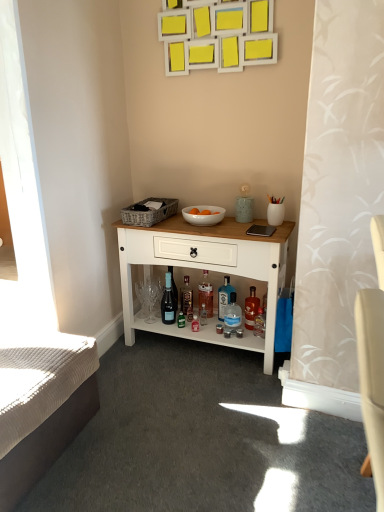
What do you see at coordinates (224, 296) in the screenshot? This screenshot has height=512, width=384. I see `blue glass bottle at lower center, which ranks as the 3th bottle in right-to-left order` at bounding box center [224, 296].

Describe the element at coordinates (205, 268) in the screenshot. I see `white wood cabinet at center` at that location.

Locate an element on the screen. This screenshot has width=384, height=512. white wood cabinet at center is located at coordinates (205, 268).

In the scene shown: In order to face translucent glass bottle at center, the fourth bottle viewed from the right, should I rotate leftwards or rightwards?

You should look right and rotate roughly 1.854 degrees.

The image size is (384, 512). Describe the element at coordinates (251, 308) in the screenshot. I see `translucent glass bottle at lower center, which appears as the first bottle when viewed from the right` at that location.

You are a GUI agent. You are given a task and a screenshot of the screen. Output one action in this format:
    pyautogui.click(x=<x>, y=<y>)
    Task: Click on the white textured mattress at lower left
    This screenshot has height=512, width=384.
    Given the screenshot: What is the action you would take?
    pyautogui.click(x=42, y=406)

Find the location of a particular element. This screenshot has width=384, height=512. white glossy bowl at center is located at coordinates (204, 215).

Is white glossy bowl at center surrounded by translucent glass bottle at lower center, placed as the fifth bottle when sorted from left to right?

No, translucent glass bottle at lower center, placed as the fifth bottle when sorted from left to right, does not contain white glossy bowl at center.

Which point is more forward, [251,320] or [194,207]?

The point [251,320] is closer.

Is translucent glass bottle at lower center, placed as the fifth bottle when sorted from left to right, oriented towards white glossy bowl at center?

No, translucent glass bottle at lower center, placed as the fifth bottle when sorted from left to right, is not turned towards white glossy bowl at center.

Starting from the white wood cabinet at center, which bottle is the 4th one behind? Please provide its 2D coordinates.

[(206, 294)]

Is the surface of white wood cabinet at center in direct contact with translucent glass bottle at center, which ranks as the second bottle in left-to-right order?

No, white wood cabinet at center is not with translucent glass bottle at center, which ranks as the second bottle in left-to-right order.

Is white wood cabinet at center oriented away from translucent glass bottle at center, which ranks as the second bottle in left-to-right order?

Yes, translucent glass bottle at center, which ranks as the second bottle in left-to-right order, is at the back of white wood cabinet at center.

Considering the relative sizes of white wood cabinet at center and translucent glass bottle at center, the fourth bottle viewed from the right, in the image provided, is white wood cabinet at center shorter than translucent glass bottle at center, the fourth bottle viewed from the right,?

No.

Does translucent glass bottle at lower center, placed as the fifth bottle when sorted from left to right, have a larger size compared to white wood cabinet at center?

No.

Considering the positions of objects translucent glass bottle at lower center, which appears as the first bottle when viewed from the right, and white wood cabinet at center in the image provided, who is behind, translucent glass bottle at lower center, which appears as the first bottle when viewed from the right, or white wood cabinet at center?

translucent glass bottle at lower center, which appears as the first bottle when viewed from the right, is more distant.

Is translucent glass bottle at lower center, placed as the fifth bottle when sorted from left to right, at the left side of white wood cabinet at center?

No.

From a real-world perspective, which is physically above, translucent glass bottle at center, the fourth bottle viewed from the right, or transparent glass bottle at center, the 4th bottle when ordered from left to right?

translucent glass bottle at center, the fourth bottle viewed from the right, from a real-world perspective.

Is point (211, 296) more distant than point (230, 304)?

Yes, point (211, 296) is farther from viewer.

Based on their positions, is translucent glass bottle at center, the fourth bottle viewed from the right, located to the left or right of transparent glass bottle at center, the 4th bottle when ordered from left to right?

Based on their positions, translucent glass bottle at center, the fourth bottle viewed from the right, is located to the left of transparent glass bottle at center, the 4th bottle when ordered from left to right.

From their relative heights in the image, would you say translucent glass bottle at center, which ranks as the second bottle in left-to-right order, is taller or shorter than transparent glass bottle at center, which is counted as the second bottle, starting from the right?

Considering their sizes, translucent glass bottle at center, which ranks as the second bottle in left-to-right order, has more height than transparent glass bottle at center, which is counted as the second bottle, starting from the right.

Between point (173, 334) and point (221, 288), which one is positioned behind?

The point (221, 288) is more distant.

Does white wood cabinet at center appear on the right side of blue glass bottle at lower center, which ranks as the 3th bottle in right-to-left order?

No, white wood cabinet at center is not to the right of blue glass bottle at lower center, which ranks as the 3th bottle in right-to-left order.

Find the location of a particular element. This screenshot has width=384, height=512. desk on the left of blue glass bottle at lower center, the 3th bottle positioned from the left is located at coordinates (205, 268).

How much distance is there between white wood cabinet at center and blue glass bottle at lower center, the 3th bottle positioned from the left?

The distance of white wood cabinet at center from blue glass bottle at lower center, the 3th bottle positioned from the left, is 37.96 centimeters.

Is translucent glass bottle at lower center, placed as the fifth bottle when sorted from left to right, facing towards blue glass bottle at lower center, the 3th bottle positioned from the left?

No.

Between point (254, 315) and point (224, 283), which one is positioned behind?

The point (224, 283) is more distant.

Is there a large distance between translucent glass bottle at lower center, which appears as the first bottle when viewed from the right, and blue glass bottle at lower center, which ranks as the 3th bottle in right-to-left order?

translucent glass bottle at lower center, which appears as the first bottle when viewed from the right, is actually quite close to blue glass bottle at lower center, which ranks as the 3th bottle in right-to-left order.

From a real-world perspective, which is physically above, translucent glass bottle at lower center, placed as the fifth bottle when sorted from left to right, or blue glass bottle at lower center, which ranks as the 3th bottle in right-to-left order?

In real-world perspective, blue glass bottle at lower center, which ranks as the 3th bottle in right-to-left order, is above.

You are a GUI agent. You are given a task and a screenshot of the screen. Output one action in this format:
    pyautogui.click(x=<x>, y=<y>)
    Task: Click on the 1st bottle positioned above the transparent glass bottle at center, the 4th bottle when ordered from left to right (from a real-world perspective)
    Image resolution: width=384 pixels, height=512 pixels.
    Given the screenshot: What is the action you would take?
    pyautogui.click(x=251, y=308)

Between translucent glass bottle at lower center, which appears as the first bottle when viewed from the right, and transparent glass bottle at center, the 4th bottle when ordered from left to right, which one has larger size?

Bigger between the two is translucent glass bottle at lower center, which appears as the first bottle when viewed from the right.

Considering the points (247, 318) and (232, 293), which point is behind, point (247, 318) or point (232, 293)?

The point (232, 293) is behind.

From a real-world perspective, between translucent glass bottle at lower center, placed as the fifth bottle when sorted from left to right, and transparent glass bottle at center, the 4th bottle when ordered from left to right, who is vertically lower?

transparent glass bottle at center, the 4th bottle when ordered from left to right, is physically lower.

At what (x,y) coordinates should I click in order to perform the action: click on bottle that is the 2nd object located behind the white glossy bowl at center. Please return your answer as a coordinate pair (x, y). This screenshot has height=512, width=384. Looking at the image, I should click on (251, 308).

Where is `the 1st bottle counting from the right of the white wood cabinet at center`? the 1st bottle counting from the right of the white wood cabinet at center is located at coordinates (206, 294).

Based on the photo, from the image, which object appears to be farther from translucent glass bottle at center, which is the fifth bottle from right to left, translucent glass bottle at lower center, which appears as the first bottle when viewed from the right, or white wood cabinet at center?

Based on the image, white wood cabinet at center appears to be further to translucent glass bottle at center, which is the fifth bottle from right to left.

From the picture: Which object lies nearer to the anchor point white textured mattress at lower left, translucent glass bottle at center, which appears as the first bottle when viewed from the left, or white glossy bowl at center?

Among the two, translucent glass bottle at center, which appears as the first bottle when viewed from the left, is located nearer to white textured mattress at lower left.

Considering their positions, is matte glass wine bottle at center positioned further to transparent glass bottle at center, the 4th bottle when ordered from left to right, than translucent glass bottle at lower center, placed as the fifth bottle when sorted from left to right?

Based on the image, matte glass wine bottle at center appears to be further to transparent glass bottle at center, the 4th bottle when ordered from left to right.

When comparing their distances from translucent glass bottle at center, the fourth bottle viewed from the right, does white glossy bowl at center or white wood cabinet at center seem closer?

Among the two, white wood cabinet at center is located nearer to translucent glass bottle at center, the fourth bottle viewed from the right.

Considering their positions, is translucent glass bottle at center, which ranks as the second bottle in left-to-right order, positioned further to translucent glass bottle at center, which appears as the first bottle when viewed from the left, than blue glass bottle at lower center, the 3th bottle positioned from the left?

The object further to translucent glass bottle at center, which appears as the first bottle when viewed from the left, is blue glass bottle at lower center, the 3th bottle positioned from the left.

Considering their positions, is white textured mattress at lower left positioned further to translucent glass bottle at center, which ranks as the second bottle in left-to-right order, than white glossy bowl at center?

white textured mattress at lower left.

Based on their spatial positions, is blue glass bottle at lower center, the 3th bottle positioned from the left, or white textured mattress at lower left further from transparent glass bottle at center, which is counted as the second bottle, starting from the right?

Among the two, white textured mattress at lower left is located further to transparent glass bottle at center, which is counted as the second bottle, starting from the right.

Which object lies nearer to the anchor point white textured mattress at lower left, translucent glass bottle at center, which ranks as the second bottle in left-to-right order, or blue glass bottle at lower center, the 3th bottle positioned from the left?

blue glass bottle at lower center, the 3th bottle positioned from the left.

The image size is (384, 512). I want to click on wine bottle between white glossy bowl at center and translucent glass bottle at center, which is the fifth bottle from right to left, in the vertical direction, so click(x=168, y=302).

Identify the location of bottle between matte glass wine bottle at center and translucent glass bottle at center, the fourth bottle viewed from the right. (186, 298).

The image size is (384, 512). Identify the location of wine bottle positioned between white textured mattress at lower left and translucent glass bottle at center, which is the fifth bottle from right to left, from near to far. (168, 302).

You are a GUI agent. You are given a task and a screenshot of the screen. Output one action in this format:
    pyautogui.click(x=<x>, y=<y>)
    Task: Click on the desk between white glossy bowl at center and blue glass bottle at lower center, which ranks as the 3th bottle in right-to-left order, in the up-down direction
    The width and height of the screenshot is (384, 512).
    Given the screenshot: What is the action you would take?
    coord(205,268)